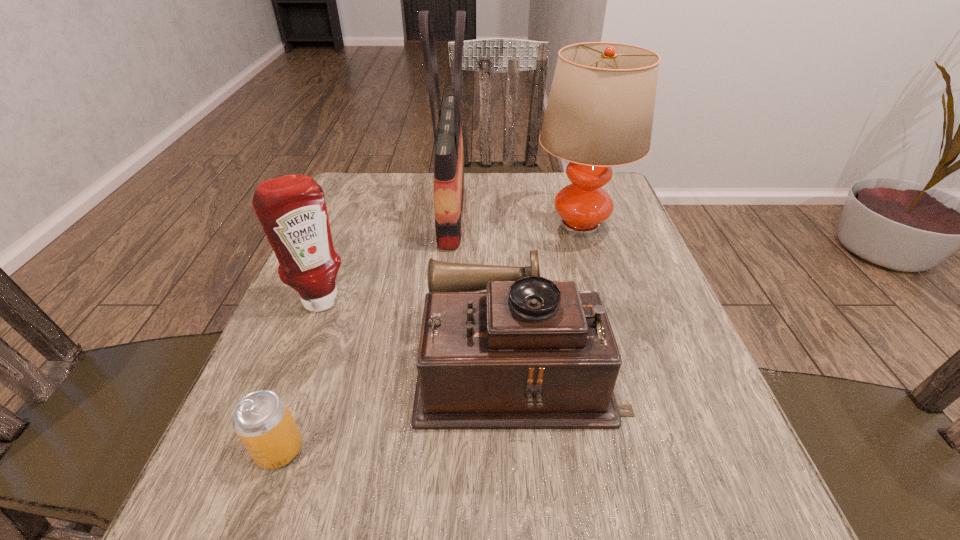
Find the location of a particular element. This screenshot has height=540, width=960. vacant area that lies between the third tallest object and the shopping bag is located at coordinates (386, 256).

Identify the location of vacant point located between the pop (soda) and the phonograph_record. The image size is (960, 540). (399, 407).

Locate which object ranks in proximity to the phonograph_record. Please provide its 2D coordinates. Your answer should be formatted as a tuple, i.e. [(x, y)], where the tuple contains the x and y coordinates of a point satisfying the conditions above.

[(262, 420)]

Select which object appears as the fourth closest to the shopping bag. Please provide its 2D coordinates. Your answer should be formatted as a tuple, i.e. [(x, y)], where the tuple contains the x and y coordinates of a point satisfying the conditions above.

[(262, 420)]

The image size is (960, 540). What are the coordinates of `free space that satisfies the following two spatial constraints: 1. on the front-facing side of the lamp; 2. on the left side of the shopping bag` in the screenshot? It's located at (450, 226).